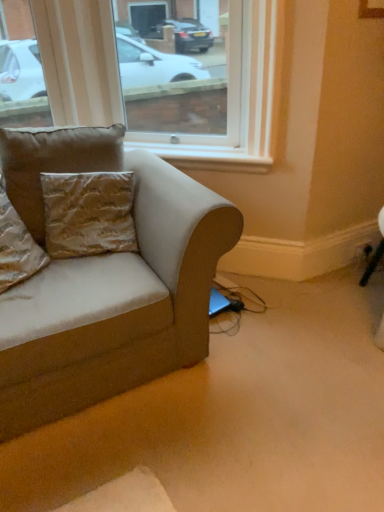
Question: From the image's perspective, is transparent glass window at upper center above gold textured pillow at upper left, which is counted as the second pillow, starting from the left?

Choices:
 (A) yes
 (B) no

Answer: (A)

Question: Does transparent glass window at upper center have a greater width compared to gold textured pillow at upper left, which ranks as the first pillow in right-to-left order?

Choices:
 (A) no
 (B) yes

Answer: (B)

Question: Can you confirm if transparent glass window at upper center is positioned to the left of gold textured pillow at upper left, which is counted as the second pillow, starting from the left?

Choices:
 (A) no
 (B) yes

Answer: (A)

Question: From the image's perspective, is transparent glass window at upper center below gold textured pillow at upper left, which ranks as the first pillow in right-to-left order?

Choices:
 (A) yes
 (B) no

Answer: (B)

Question: Is transparent glass window at upper center surrounding gold textured pillow at upper left, which ranks as the first pillow in right-to-left order?

Choices:
 (A) yes
 (B) no

Answer: (B)

Question: From a real-world perspective, is transparent glass window at upper center beneath gold textured pillow at upper left, which is counted as the second pillow, starting from the left?

Choices:
 (A) yes
 (B) no

Answer: (B)

Question: Is gold textured pillow at left, the 1th pillow viewed from the left, closer to camera compared to black plastic outlet at lower right?

Choices:
 (A) yes
 (B) no

Answer: (A)

Question: Does gold textured pillow at left, the 1th pillow viewed from the left, have a greater height compared to black plastic outlet at lower right?

Choices:
 (A) no
 (B) yes

Answer: (B)

Question: Could you tell me if gold textured pillow at left, positioned as the second pillow in right-to-left order, is facing black plastic outlet at lower right?

Choices:
 (A) yes
 (B) no

Answer: (B)

Question: Can we say gold textured pillow at left, positioned as the second pillow in right-to-left order, lies outside black plastic outlet at lower right?

Choices:
 (A) no
 (B) yes

Answer: (B)

Question: From a real-world perspective, is gold textured pillow at left, the 1th pillow viewed from the left, beneath black plastic outlet at lower right?

Choices:
 (A) yes
 (B) no

Answer: (B)

Question: From the image's perspective, does gold textured pillow at left, the 1th pillow viewed from the left, appear lower than black plastic outlet at lower right?

Choices:
 (A) no
 (B) yes

Answer: (A)

Question: Is suede-like beige couch at left placed right next to white painted wood at upper center?

Choices:
 (A) no
 (B) yes

Answer: (A)